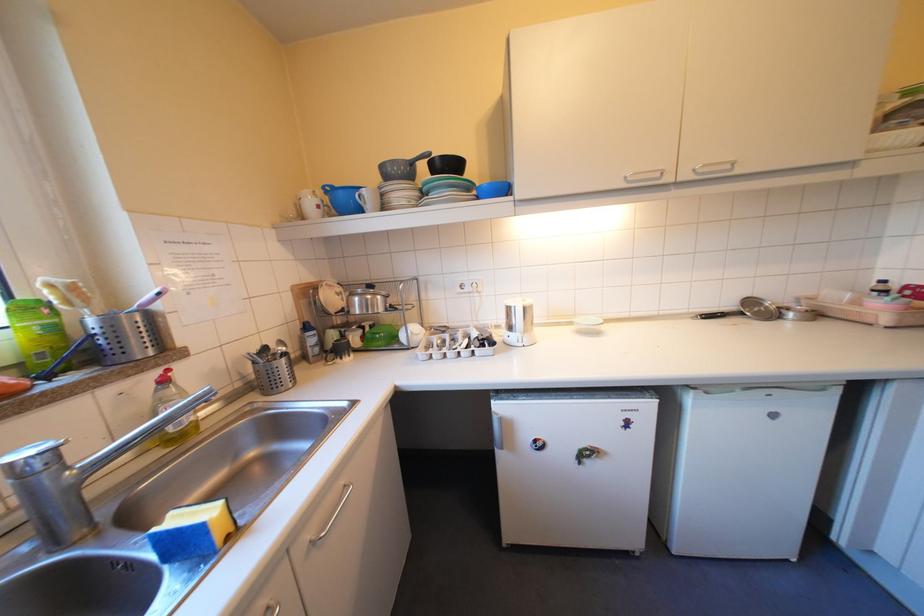
Locate an element on the screen. This screenshot has width=924, height=616. white mug handle is located at coordinates (369, 199).